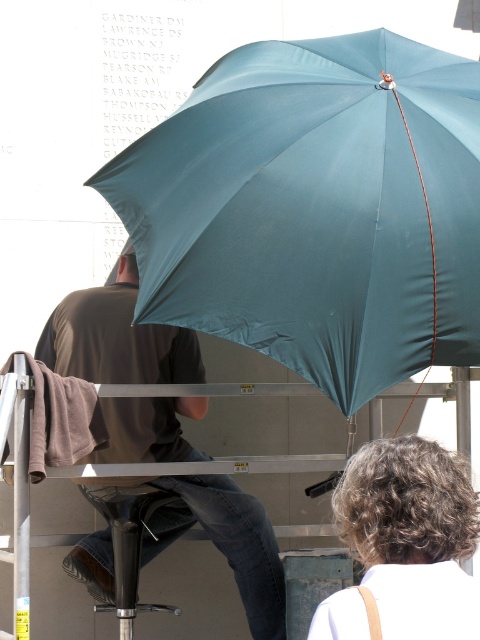
Which is below, curly hair at upper right or black plastic stool at lower center?

black plastic stool at lower center is below.

Describe the element at coordinates (406, 545) in the screenshot. The image size is (480, 640). I see `curly hair at upper right` at that location.

You are a GUI agent. You are given a task and a screenshot of the screen. Output one action in this format:
    pyautogui.click(x=<x>, y=<y>)
    Task: Click on the curly hair at upper right
    This screenshot has width=480, height=640.
    Given the screenshot: What is the action you would take?
    pyautogui.click(x=406, y=545)

Who is more distant from viewer, (92, 320) or (107, 496)?

The point (107, 496) is behind.

Which is above, matte black shirt at center or black plastic stool at lower center?

matte black shirt at center

This screenshot has height=640, width=480. In order to click on matte black shirt at center in this screenshot , I will do `click(117, 337)`.

In order to click on matte black shirt at center in this screenshot , I will do `click(117, 337)`.

Which is above, teal fabric umbrella at upper center or black plastic stool at lower center?

teal fabric umbrella at upper center

Is teal fabric umbrella at upper center above black plastic stool at lower center?

Correct, teal fabric umbrella at upper center is located above black plastic stool at lower center.

Does point (255, 314) lie behind point (115, 536)?

No, it is not.

This screenshot has width=480, height=640. In order to click on teal fabric umbrella at upper center in this screenshot , I will do `click(315, 209)`.